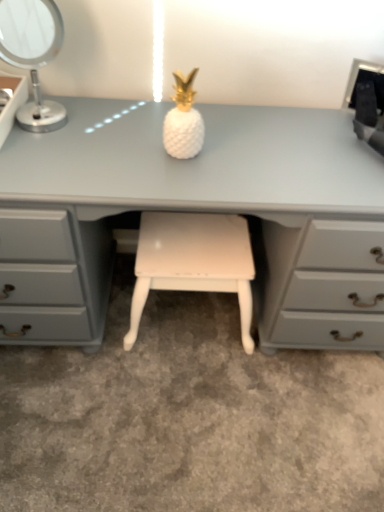
Where is `white glossy pineapple at center`? white glossy pineapple at center is located at coordinates (183, 120).

Looking at this image, measure the distance between black plastic desktop computer at upper right and camera.

A distance of 1.11 meters exists between black plastic desktop computer at upper right and camera.

The height and width of the screenshot is (512, 384). What do you see at coordinates (367, 102) in the screenshot? I see `black plastic desktop computer at upper right` at bounding box center [367, 102].

At what (x,y) coordinates should I click in order to perform the action: click on white painted wood stool at center. Please return your answer as a coordinate pair (x, y). Image resolution: width=384 pixels, height=512 pixels. Looking at the image, I should click on (193, 262).

Does white glossy pineapple at center lie in front of silver metallic table lamp at upper left?

That is False.

Based on the photo, based on their positions, is white glossy pineapple at center located to the left or right of silver metallic table lamp at upper left?

Clearly, white glossy pineapple at center is on the right of silver metallic table lamp at upper left in the image.

From the image's perspective, is white glossy pineapple at center beneath silver metallic table lamp at upper left?

Indeed, from the image's perspective, white glossy pineapple at center is shown beneath silver metallic table lamp at upper left.

Is point (372, 111) closer or farther from the camera than point (244, 304)?

Point (372, 111) is closer to the camera than point (244, 304).

Does black plastic desktop computer at upper right have a lesser height compared to white painted wood stool at center?

Yes.

From a real-world perspective, relative to white painted wood stool at center, is black plastic desktop computer at upper right vertically above or below?

black plastic desktop computer at upper right is situated higher than white painted wood stool at center in the real world.

How much distance is there between black plastic desktop computer at upper right and white painted wood stool at center?

black plastic desktop computer at upper right and white painted wood stool at center are 22.94 inches apart from each other.

Can you confirm if black plastic desktop computer at upper right is shorter than white glossy pineapple at center?

Correct, black plastic desktop computer at upper right is not as tall as white glossy pineapple at center.

Is black plastic desktop computer at upper right touching white glossy pineapple at center?

No, black plastic desktop computer at upper right is not in contact with white glossy pineapple at center.

Is black plastic desktop computer at upper right to the left or to the right of white glossy pineapple at center in the image?

black plastic desktop computer at upper right is positioned on white glossy pineapple at center's right side.

In the scene shown: What's the angular difference between black plastic desktop computer at upper right and white glossy pineapple at center's facing directions?

The angular difference between black plastic desktop computer at upper right and white glossy pineapple at center is 31 degrees.

From a real-world perspective, relative to black plastic desktop computer at upper right, is white painted wood stool at center vertically above or below?

white painted wood stool at center is situated lower than black plastic desktop computer at upper right in the real world.

Looking at this image, from the image's perspective, is white painted wood stool at center on top of black plastic desktop computer at upper right?

Actually, white painted wood stool at center appears below black plastic desktop computer at upper right in the image.

Is white painted wood stool at center aimed at black plastic desktop computer at upper right?

No.

Considering the relative positions of white glossy pineapple at center and black plastic desktop computer at upper right in the image provided, is white glossy pineapple at center to the right of black plastic desktop computer at upper right from the viewer's perspective?

No, white glossy pineapple at center is not to the right of black plastic desktop computer at upper right.

This screenshot has width=384, height=512. Identify the location of miniature that is above the black plastic desktop computer at upper right (from a real-world perspective). (183, 120).

Are white glossy pineapple at center and black plastic desktop computer at upper right located far from each other?

That's not correct — white glossy pineapple at center is a little close to black plastic desktop computer at upper right.

From the picture: Can you tell me how much white glossy pineapple at center and black plastic desktop computer at upper right differ in facing direction?

They differ by 31 degrees in their facing directions.

Would you say silver metallic table lamp at upper left contains white glossy pineapple at center?

No, white glossy pineapple at center is located outside of silver metallic table lamp at upper left.

Can you confirm if silver metallic table lamp at upper left is thinner than white glossy pineapple at center?

In fact, silver metallic table lamp at upper left might be wider than white glossy pineapple at center.

The width and height of the screenshot is (384, 512). What are the coordinates of `miniature behind the silver metallic table lamp at upper left` in the screenshot? It's located at (183, 120).

From the image's perspective, which object appears higher, silver metallic table lamp at upper left or white glossy pineapple at center?

silver metallic table lamp at upper left is shown above in the image.

Considering the relative sizes of silver metallic table lamp at upper left and black plastic desktop computer at upper right in the image provided, is silver metallic table lamp at upper left bigger than black plastic desktop computer at upper right?

Yes.

In the scene shown: Is silver metallic table lamp at upper left far away from black plastic desktop computer at upper right?

That's not correct — silver metallic table lamp at upper left is a little close to black plastic desktop computer at upper right.

From a real-world perspective, is silver metallic table lamp at upper left over black plastic desktop computer at upper right?

Yes.

Considering the relative positions of silver metallic table lamp at upper left and black plastic desktop computer at upper right in the image provided, is silver metallic table lamp at upper left to the right of black plastic desktop computer at upper right from the viewer's perspective?

Incorrect, silver metallic table lamp at upper left is not on the right side of black plastic desktop computer at upper right.

The height and width of the screenshot is (512, 384). Identify the location of table lamp that is above the white glossy pineapple at center (from the image's perspective). (33, 55).

Find the location of `stool behind the black plastic desktop computer at upper right`. stool behind the black plastic desktop computer at upper right is located at coordinates (193, 262).

Looking at the image, which one is located closer to white painted wood stool at center, silver metallic table lamp at upper left or white glossy pineapple at center?

The object closer to white painted wood stool at center is white glossy pineapple at center.

Considering their positions, is matte white desk at center positioned closer to silver metallic table lamp at upper left than white painted wood stool at center?

matte white desk at center is positioned closer to the anchor silver metallic table lamp at upper left.

Based on their spatial positions, is silver metallic table lamp at upper left or black plastic desktop computer at upper right further from white painted wood stool at center?

The object further to white painted wood stool at center is black plastic desktop computer at upper right.

Which object lies nearer to the anchor point white glossy pineapple at center, white painted wood stool at center or matte white desk at center?

matte white desk at center.

Estimate the real-world distances between objects in this image. Which object is further from black plastic desktop computer at upper right, white painted wood stool at center or matte white desk at center?

white painted wood stool at center is further to black plastic desktop computer at upper right.

Considering their positions, is white glossy pineapple at center positioned further to silver metallic table lamp at upper left than black plastic desktop computer at upper right?

The object further to silver metallic table lamp at upper left is black plastic desktop computer at upper right.

Which object lies nearer to the anchor point matte white desk at center, white glossy pineapple at center or silver metallic table lamp at upper left?

white glossy pineapple at center.

When comparing their distances from matte white desk at center, does silver metallic table lamp at upper left or white glossy pineapple at center seem further?

Among the two, silver metallic table lamp at upper left is located further to matte white desk at center.

Identify the location of desk between silver metallic table lamp at upper left and white painted wood stool at center vertically. (202, 170).

This screenshot has height=512, width=384. In order to click on stool between white glossy pineapple at center and black plastic desktop computer at upper right in this screenshot , I will do `click(193, 262)`.

Locate an element on the screen. desk between white glossy pineapple at center and white painted wood stool at center vertically is located at coordinates (202, 170).

Identify the location of miniature located between silver metallic table lamp at upper left and black plastic desktop computer at upper right in the left-right direction. The width and height of the screenshot is (384, 512). (183, 120).